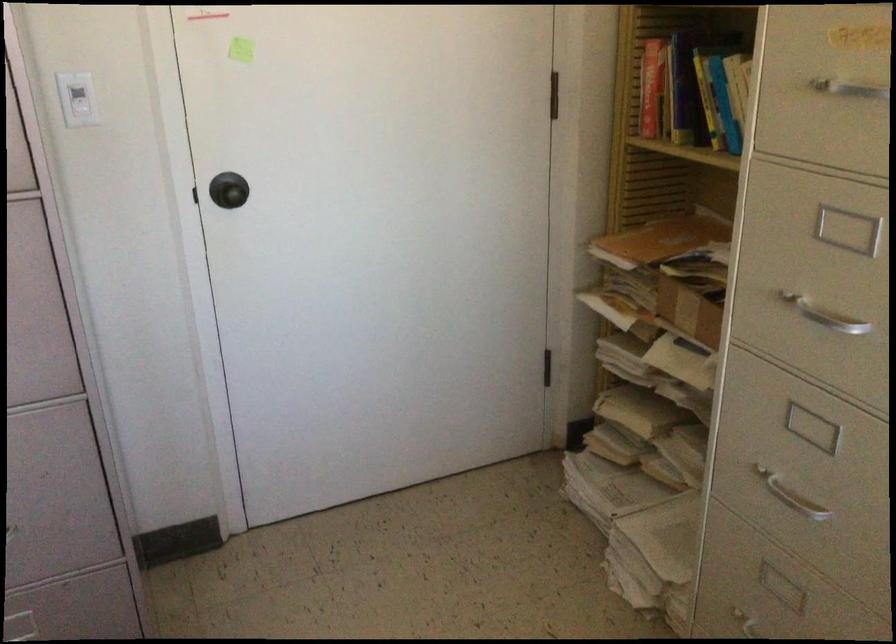
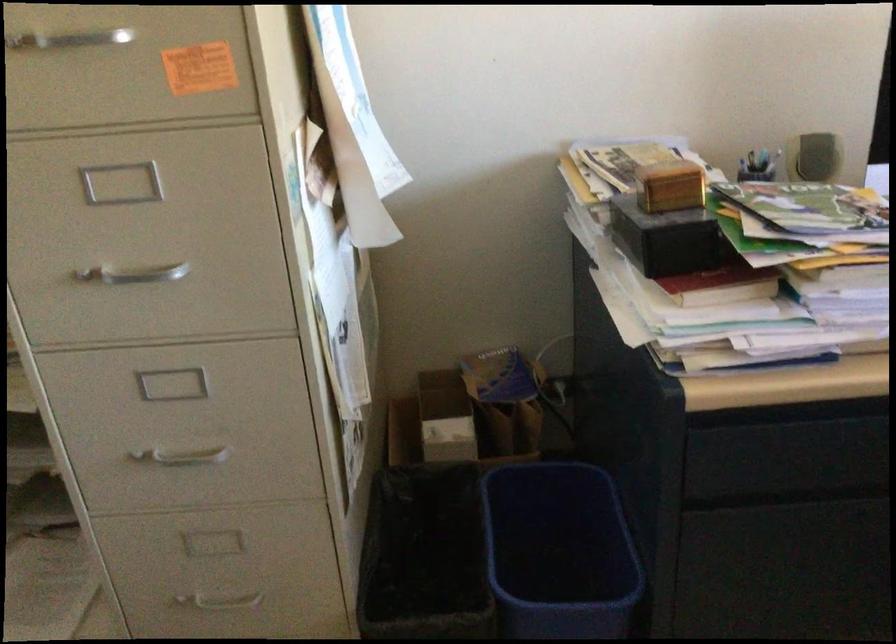
Question: How did the camera likely rotate?

Choices:
 (A) Left
 (B) Right
 (C) Up
 (D) Down

Answer: (B)